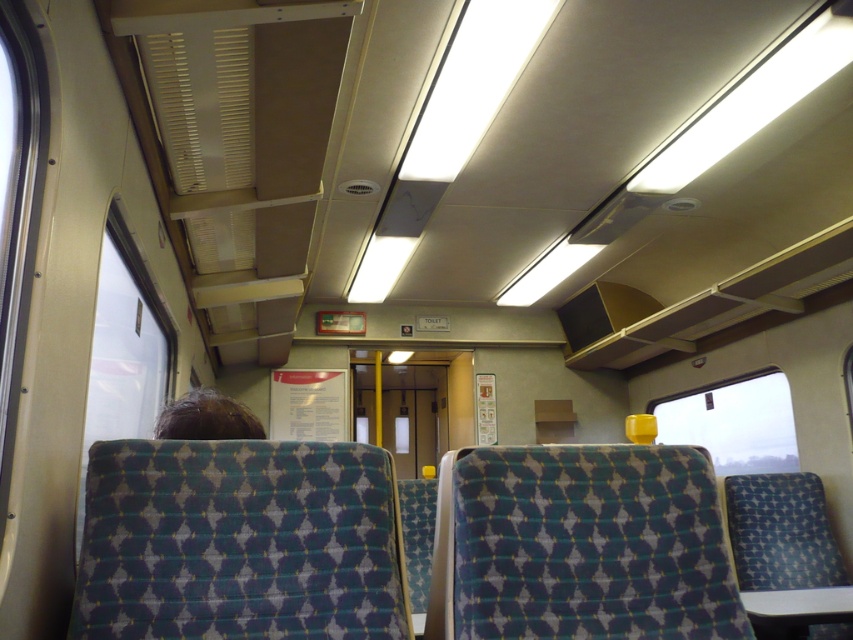
Does transparent glass window at left appear on the right side of transparent yellow cup at right?

In fact, transparent glass window at left is to the left of transparent yellow cup at right.

Is point (79, 544) more distant than point (790, 410)?

No, it is in front of (790, 410).

The image size is (853, 640). I want to click on transparent glass window at left, so click(x=125, y=349).